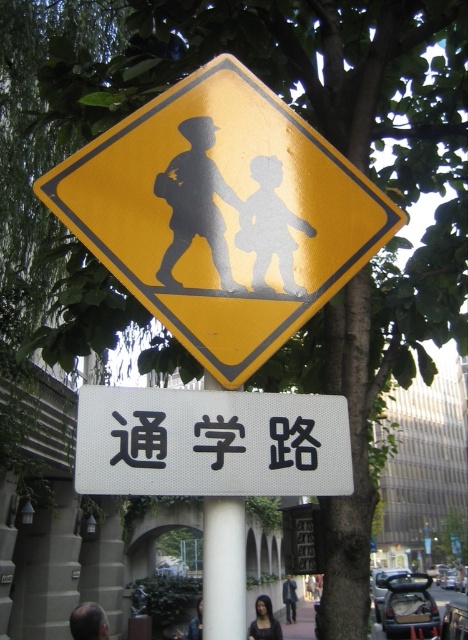
You are standing in front of the yellow diamond road sign with two children holding hands and the white School Road sign below it. There are two points marked in the image at coordinates point (177, 296) and point (124, 458). Which point is closer to you?

Point (124, 458) is closer to you because it is less further to the camera than point (177, 296).

Consider the image. Please write a question that asks about the position of the yellow matte pedestrian crossing sign at upper center relative to other objects in the scene, ensuring all object labels from the Objects section are mentioned in the question without revealing specific details from the Objects Description. The question should be framed from an observer standing in front of the scene.

The yellow matte pedestrian crossing sign at upper center is located at coordinates (221, 214), which places it centrally in the upper portion of the scene.